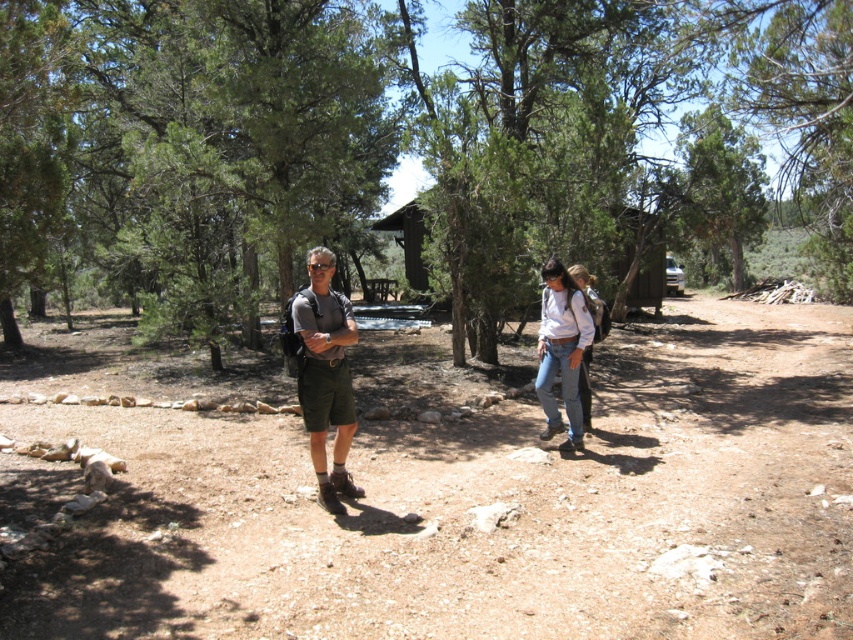
Question: Observing the image, what is the correct spatial positioning of green leafy tree at center in reference to matte khaki shorts at center?

Choices:
 (A) below
 (B) above

Answer: (B)

Question: Is green leafy tree at center positioned in front of matte khaki shorts at center?

Choices:
 (A) yes
 (B) no

Answer: (A)

Question: Which point is closer to the camera taking this photo?

Choices:
 (A) (299, 332)
 (B) (567, 289)

Answer: (A)

Question: Which of these objects is positioned farthest from the green leafy tree at center?

Choices:
 (A) matte khaki shorts at center
 (B) jeans at center

Answer: (A)

Question: Which object appears closest to the camera in this image?

Choices:
 (A) jeans at center
 (B) matte khaki shorts at center

Answer: (B)

Question: Does green leafy tree at center appear under matte khaki shorts at center?

Choices:
 (A) yes
 (B) no

Answer: (B)